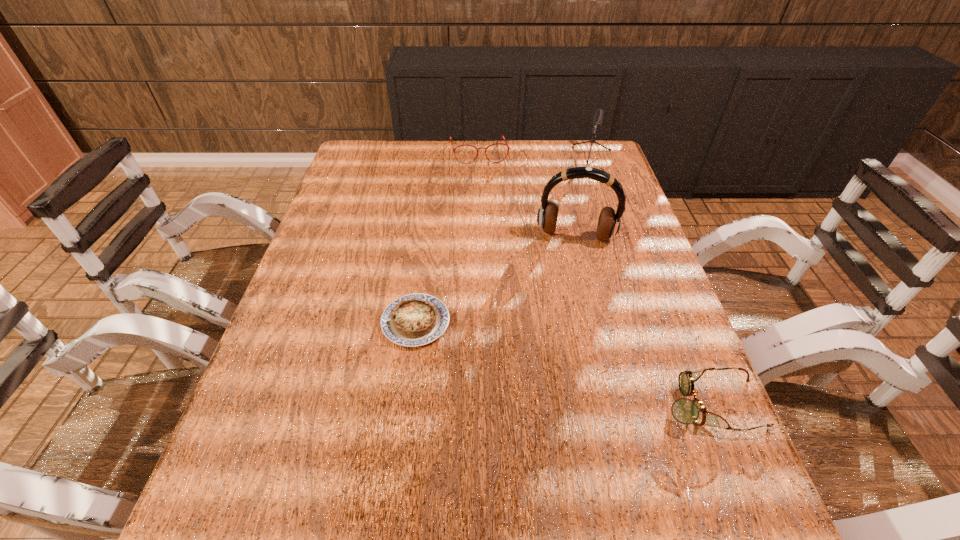
I want to click on vacant area that lies between the fourth shortest object and the headset, so click(581, 199).

You are a GUI agent. You are given a task and a screenshot of the screen. Output one action in this format:
    pyautogui.click(x=<x>, y=<y>)
    Task: Click on the vacant space in between the headset and the third shortest object
    This screenshot has height=540, width=960.
    Given the screenshot: What is the action you would take?
    pyautogui.click(x=527, y=194)

Find the location of `free spot between the left spectacles and the quiche`. free spot between the left spectacles and the quiche is located at coordinates (447, 237).

Locate which object ranks second in proximity to the fourth shortest object. Please provide its 2D coordinates. Your answer should be formatted as a tuple, i.e. [(x, y)], where the tuple contains the x and y coordinates of a point satisfying the conditions above.

[(609, 222)]

This screenshot has width=960, height=540. I want to click on object that is the closest to the nearest object, so click(x=609, y=222).

Image resolution: width=960 pixels, height=540 pixels. I want to click on free location that satisfies the following two spatial constraints: 1. on the front side of the right spectacles; 2. on the front-facing side of the microphone, so click(x=665, y=404).

At what (x,y) coordinates should I click in order to perform the action: click on vacant space that satisfies the following two spatial constraints: 1. on the front side of the nearer spectacles; 2. on the front-facing side of the microphone. Please return your answer as a coordinate pair (x, y). Image resolution: width=960 pixels, height=540 pixels. Looking at the image, I should click on (665, 404).

Identify the location of vacant space that satisfies the following two spatial constraints: 1. on the front side of the nearest object; 2. on the front-facing side of the tallest object. The width and height of the screenshot is (960, 540). (615, 404).

The image size is (960, 540). In order to click on free space that satisfies the following two spatial constraints: 1. on the back side of the left spectacles; 2. on the left side of the quiche in this screenshot , I will do `click(439, 152)`.

Find the location of a particular element. The height and width of the screenshot is (540, 960). free space that satisfies the following two spatial constraints: 1. on the front side of the fourth tallest object; 2. on the front-facing side of the quiche is located at coordinates (405, 404).